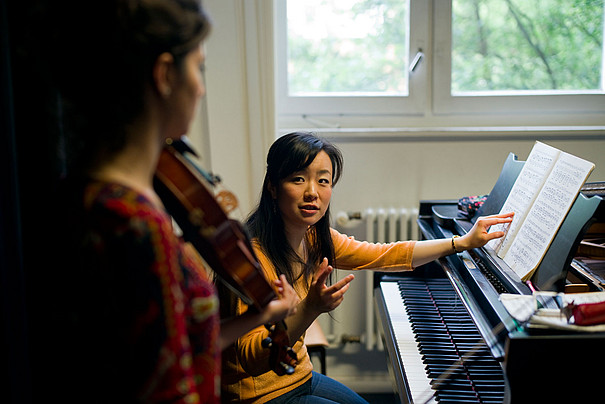
At what (x,y) coordinates should I click in order to perform the action: click on piano keys. Please return your answer as a coordinate pair (x, y). The image size is (605, 404). Looking at the image, I should click on (409, 323).